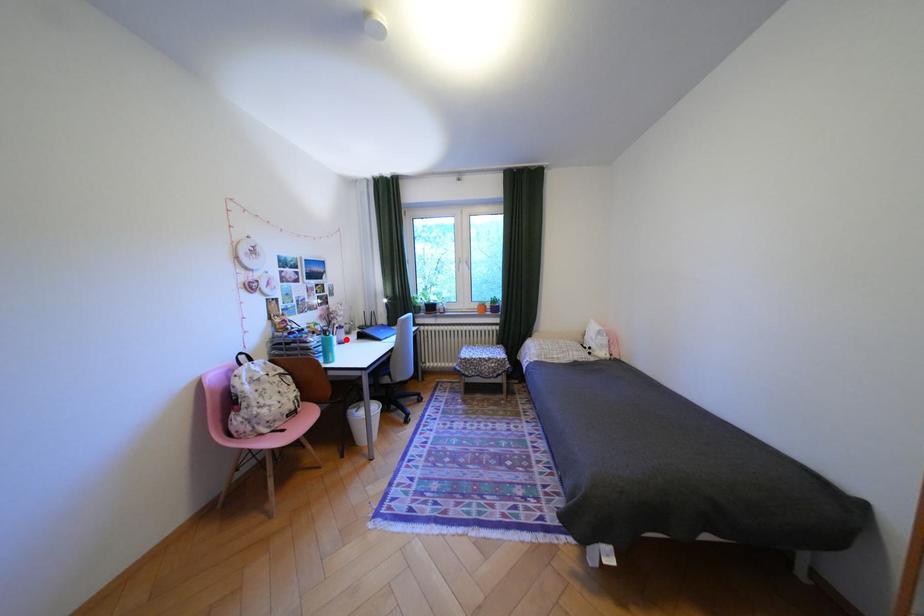
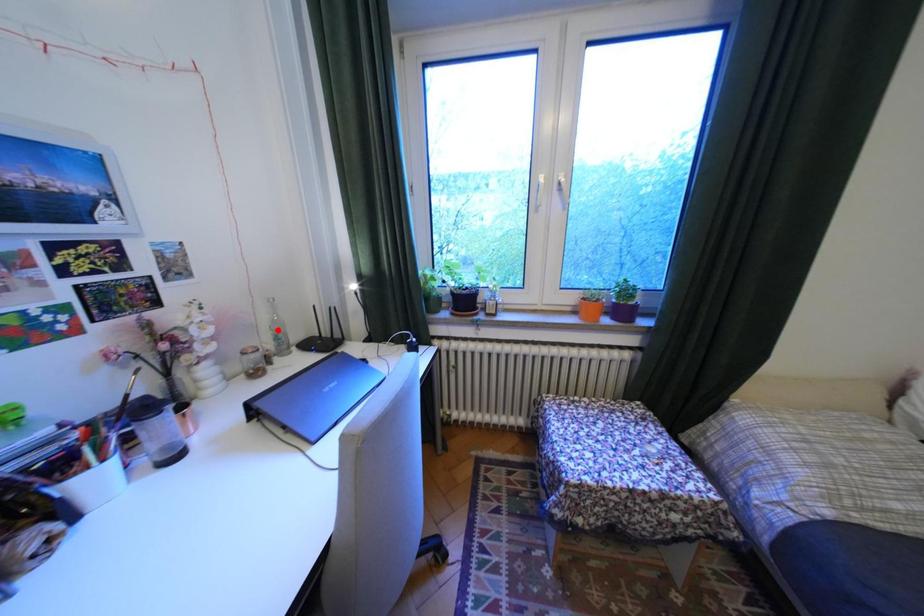
I am providing you with two images of the same scene from different viewpoints. A red point is marked on the first image and another point is marked on the second image. Are the points marked in image1 and image2 representing the same 3D position?

No